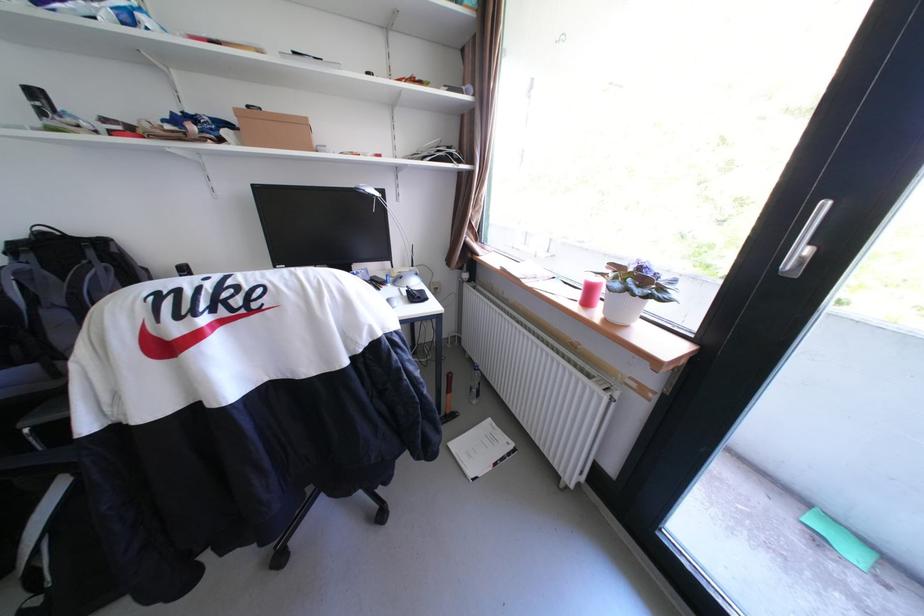
Which object does [475,386] point to?

This point indicates the clear water bottle.